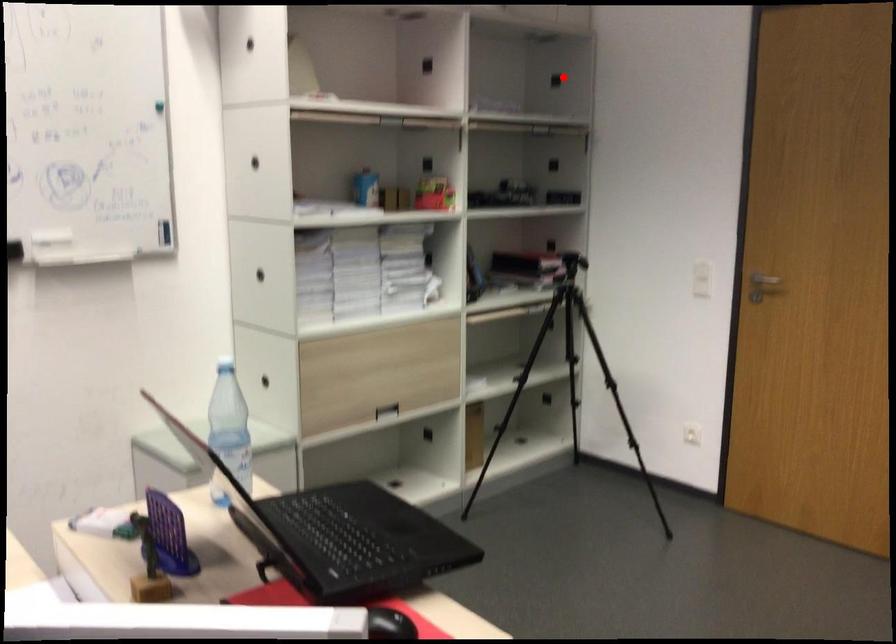
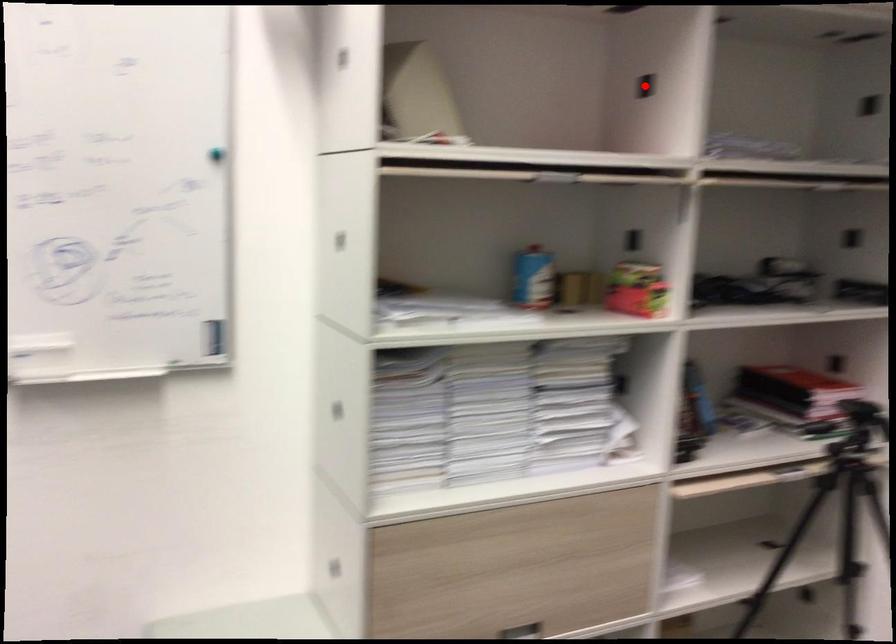
I am providing you with two images of the same scene from different viewpoints. A red point is marked on the first image and another point is marked on the second image. Does the point marked in image1 correspond to the same location as the one in image2?

No